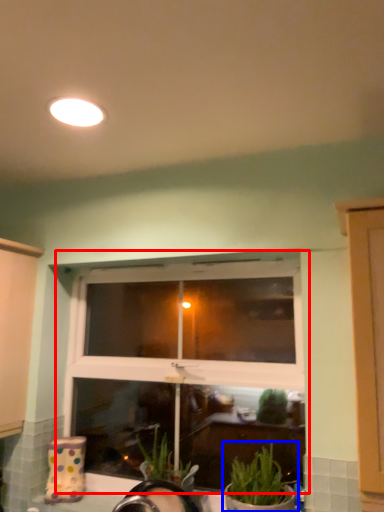
Question: Which object appears closest to the camera in this image, window (highlighted by a red box) or houseplant (highlighted by a blue box)?

Choices:
 (A) window
 (B) houseplant

Answer: (B)